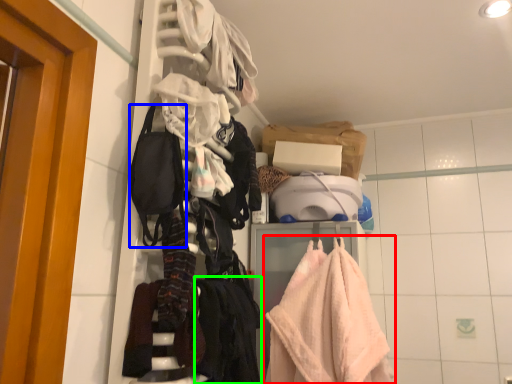
Question: Considering the real-world distances, which object is farthest from towel (highlighted by a red box)? accessory (highlighted by a blue box) or clothing (highlighted by a green box)?

Choices:
 (A) accessory
 (B) clothing

Answer: (A)